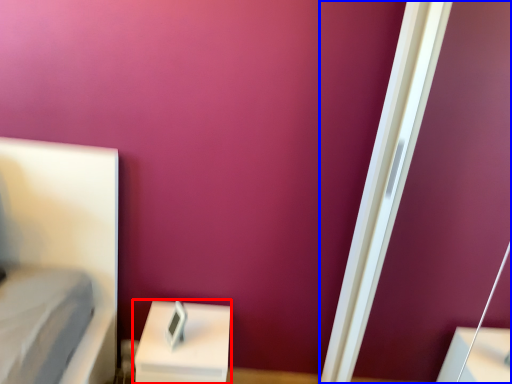
Question: Which point is closer to the camera, furniture (highlighted by a red box) or screen door (highlighted by a blue box)?

Choices:
 (A) furniture
 (B) screen door

Answer: (B)